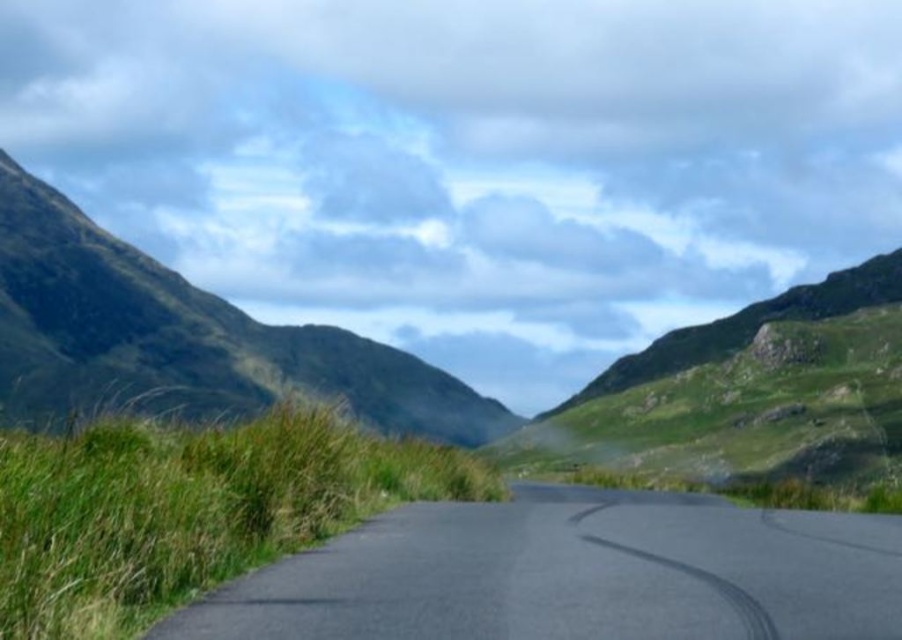
Can you confirm if black asphalt road at center is shorter than green grassy hillside at left?

Yes.

Does black asphalt road at center have a lesser width compared to green grassy hillside at left?

Yes, black asphalt road at center is thinner than green grassy hillside at left.

I want to click on black asphalt road at center, so tap(572, 573).